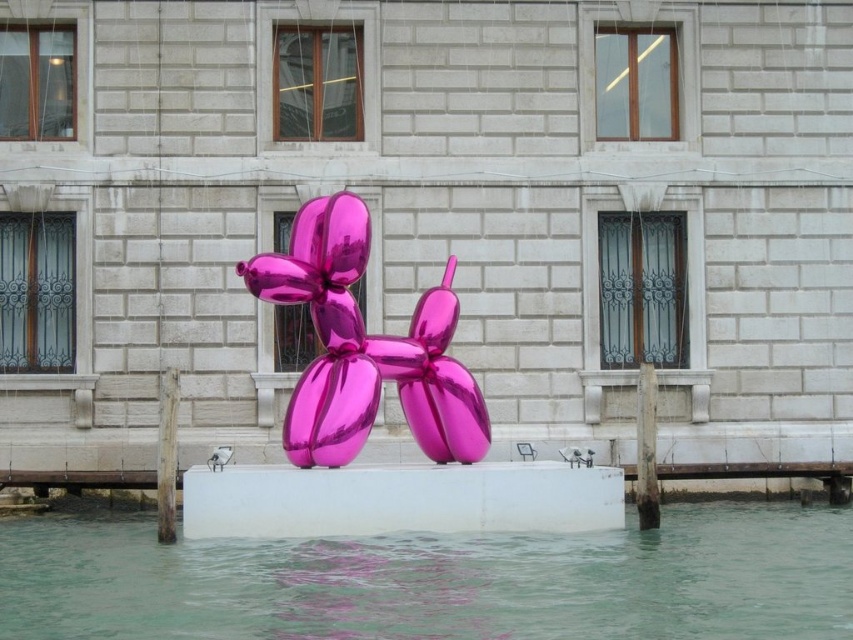
You are an artist planning to paint the scene. You want to ensure the transparent water at center and metallic pink balloon at center are proportionally accurate. Which object should you make wider in your painting?

The transparent water at center should be made wider in the painting since its width surpasses that of the metallic pink balloon at center according to the description.

You are a photographer planning to capture the reflection of the metallic pink balloon at center in the transparent water at center. Based on the scene description, can you confirm if the reflection will be fully visible in the water?

The transparent water at center is much taller than the metallic pink balloon at center, so the reflection of the metallic pink balloon at center will be fully visible in the transparent water at center.